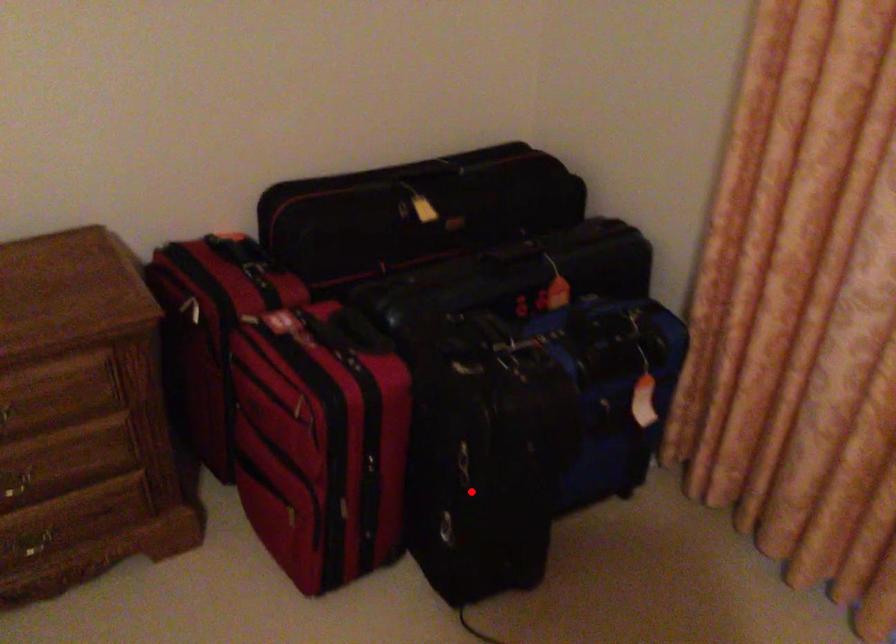
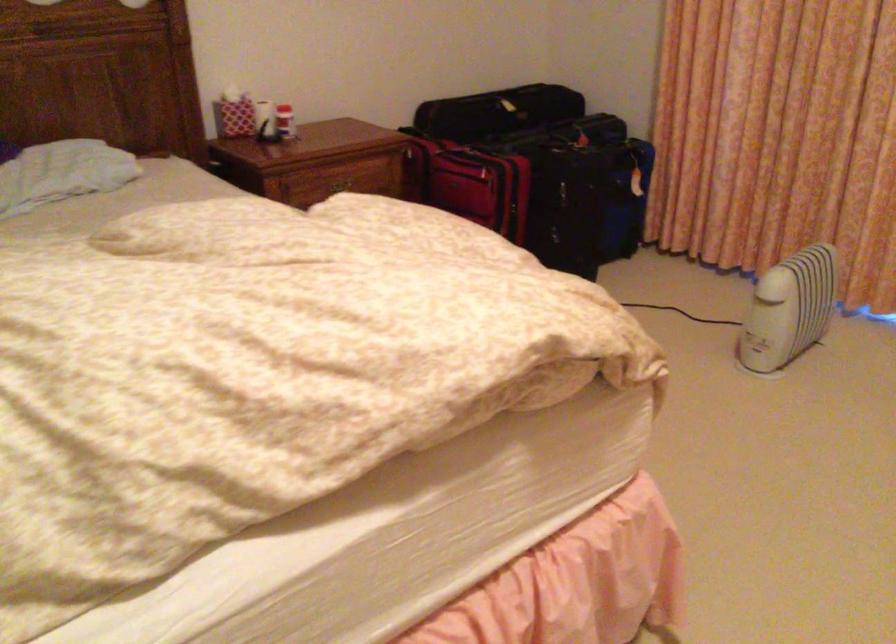
Locate, in the second image, the point that corresponds to the highlighted location in the first image.

(566, 205)